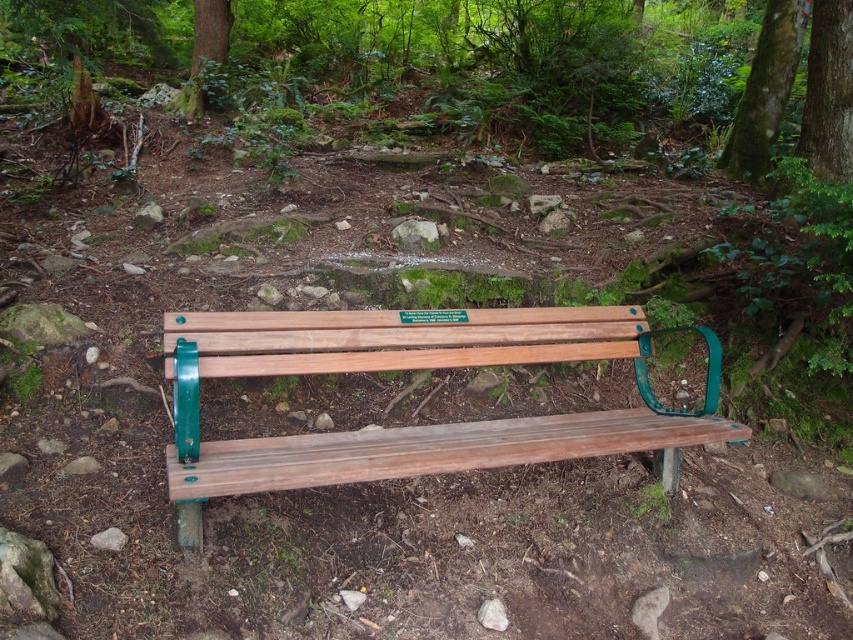
Question: Is green textured tree trunk at upper right smaller than green textured tree trunk at upper center?

Choices:
 (A) yes
 (B) no

Answer: (B)

Question: Among these objects, which one is farthest from the camera?

Choices:
 (A) green textured tree trunk at upper right
 (B) wooden bench at center

Answer: (A)

Question: Which object is positioned closest to the green textured tree trunk at upper right?

Choices:
 (A) wooden bench at center
 (B) green textured tree trunk at upper center
 (C) green textured bark at upper right

Answer: (C)

Question: Among these points, which one is nearest to the camera?

Choices:
 (A) (730, 138)
 (B) (662, 461)
 (C) (198, 58)

Answer: (B)

Question: Is wooden bench at center bigger than green textured tree trunk at upper center?

Choices:
 (A) yes
 (B) no

Answer: (A)

Question: Does wooden bench at center appear on the right side of green textured tree trunk at upper right?

Choices:
 (A) yes
 (B) no

Answer: (B)